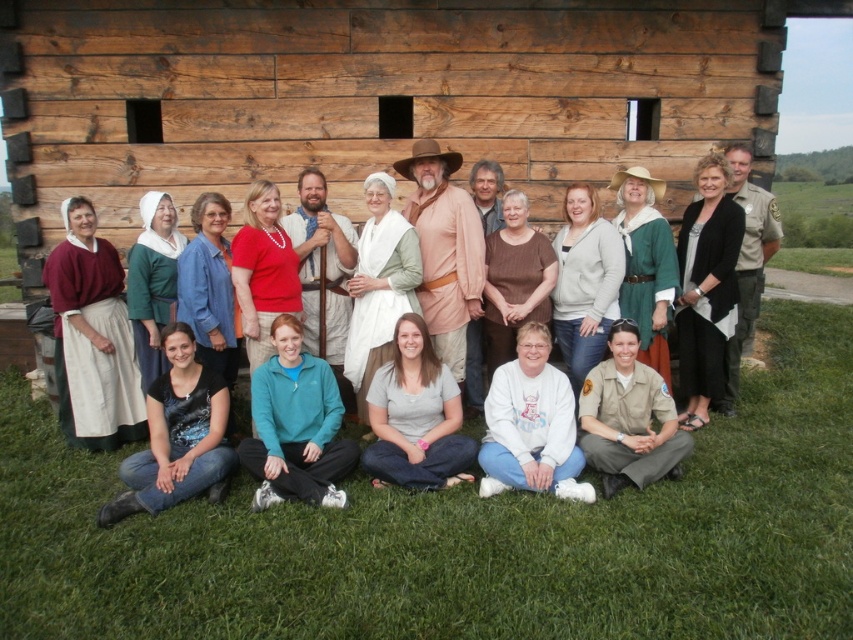
You are taking a photo of the group in front of the rustic wooden building. You notice two points marked in the image at coordinates point (607, 387) and point (720, 410). Which point is closer to the camera?

Point (607, 387) is closer to the camera than point (720, 410).

You are standing in front of the rustic wooden building and see the point at coordinates (x=706, y=289). What object is located at that point?

The point at coordinates (x=706, y=289) corresponds to the black jersey at center.